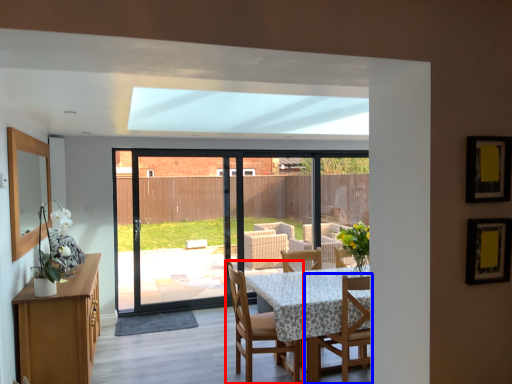
Question: Which of the following is the closest to the observer, chair (highlighted by a red box) or chair (highlighted by a blue box)?

Choices:
 (A) chair
 (B) chair

Answer: (B)